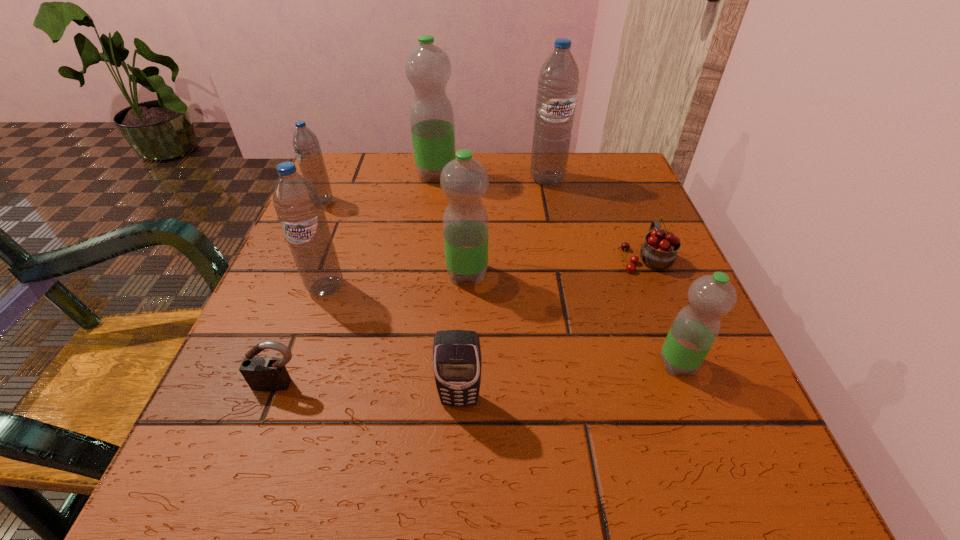
Select which blue water bottle appears as the closest to the third shortest object. Please provide its 2D coordinates. Your answer should be formatted as a tuple, i.e. [(x, y)], where the tuple contains the x and y coordinates of a point satisfying the conditions above.

[(298, 206)]